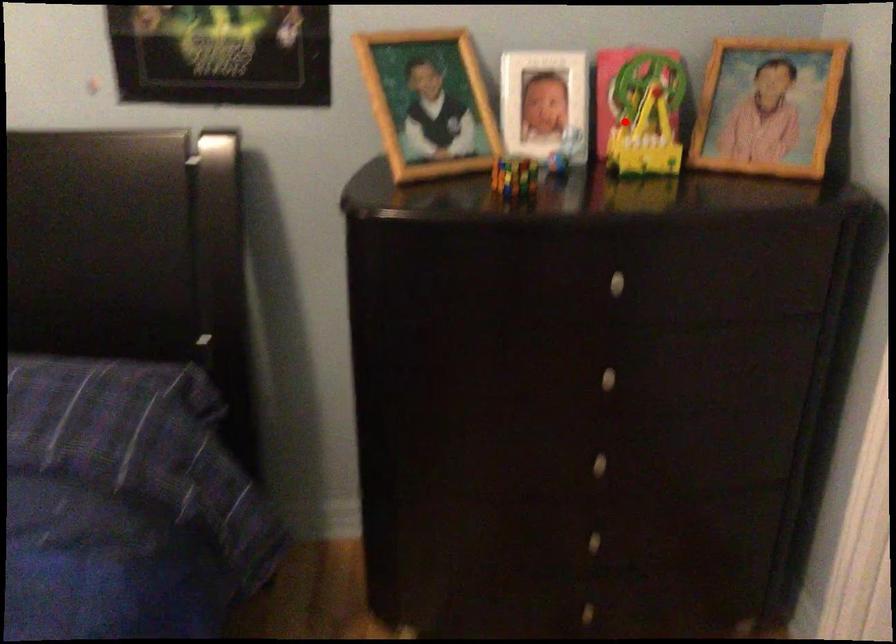
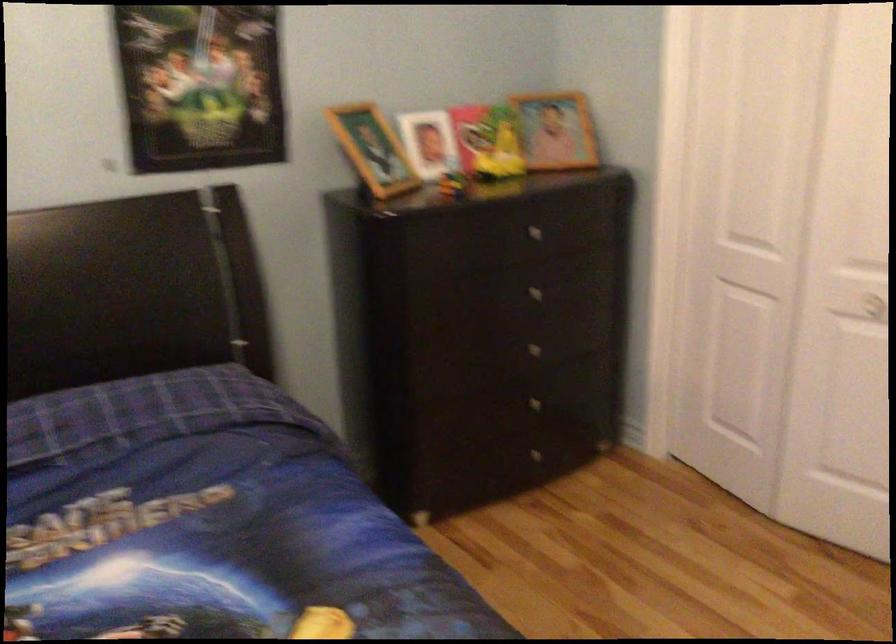
Question: I am providing you with two images of the same scene from different viewpoints. In image1, a red point is highlighted. Considering the same 3D point in image2, which of the following is correct?

Choices:
 (A) It is closer
 (B) It is farther

Answer: (B)